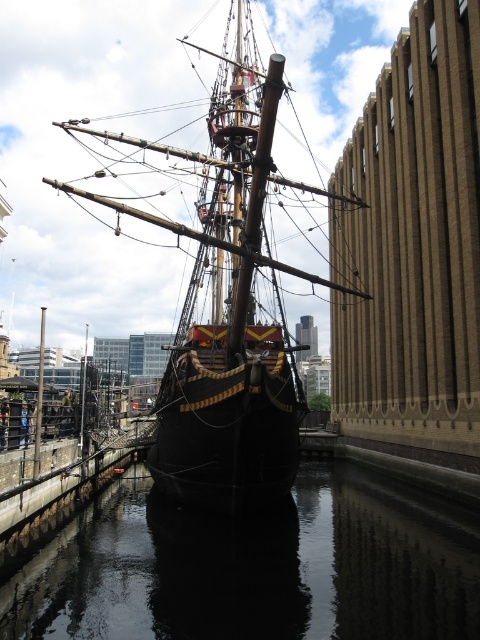
Question: Which point is farther from the camera taking this photo?

Choices:
 (A) 230,147
 (B) 304,548

Answer: (A)

Question: Does dark reflective water at center appear under dark wood ship at center?

Choices:
 (A) no
 (B) yes

Answer: (B)

Question: Which of the following is the closest to the observer?

Choices:
 (A) (227, 483)
 (B) (124, 564)

Answer: (B)

Question: Considering the relative positions of dark reflective water at center and dark wood ship at center in the image provided, where is dark reflective water at center located with respect to dark wood ship at center?

Choices:
 (A) above
 (B) below

Answer: (B)

Question: Among these points, which one is nearest to the camera?

Choices:
 (A) (228, 300)
 (B) (357, 502)

Answer: (B)

Question: Does dark reflective water at center have a lesser width compared to dark wood ship at center?

Choices:
 (A) no
 (B) yes

Answer: (A)